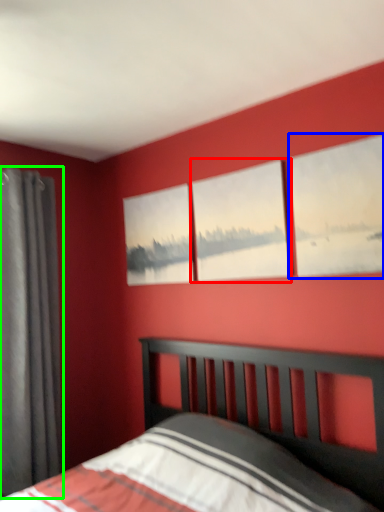
Question: Estimate the real-world distances between objects in this image. Which object is closer to window (highlighted by a red box), window (highlighted by a blue box) or curtain (highlighted by a green box)?

Choices:
 (A) window
 (B) curtain

Answer: (A)